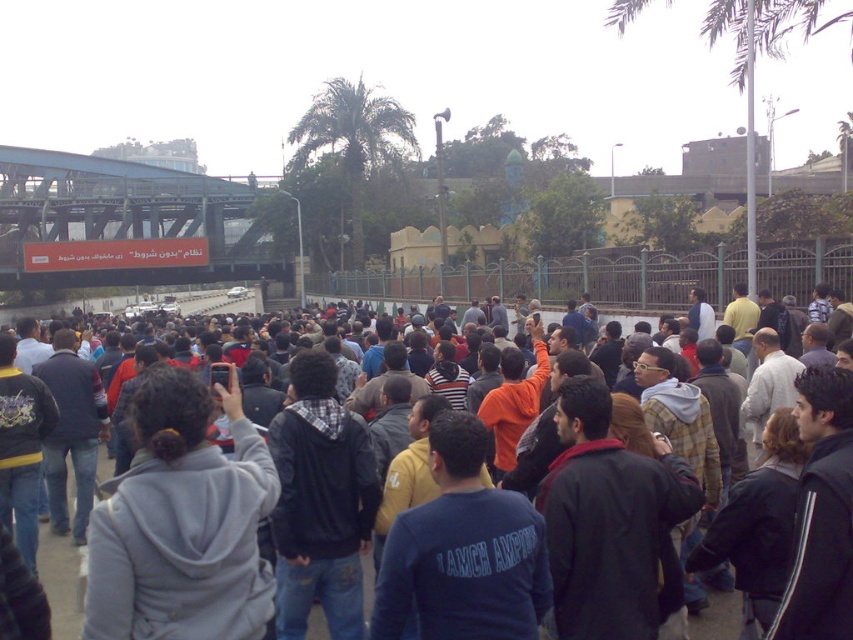
In the scene shown: You are a photographer trying to capture a photo of the dark gray hoodie at center without the green leafy palm tree at upper center blocking the view. Can you adjust your position to achieve this?

The green leafy palm tree at upper center is much taller than the dark gray hoodie at center, so lowering your camera angle or moving closer to the ground might help avoid the palm tree blocking the view of the dark gray hoodie at center.